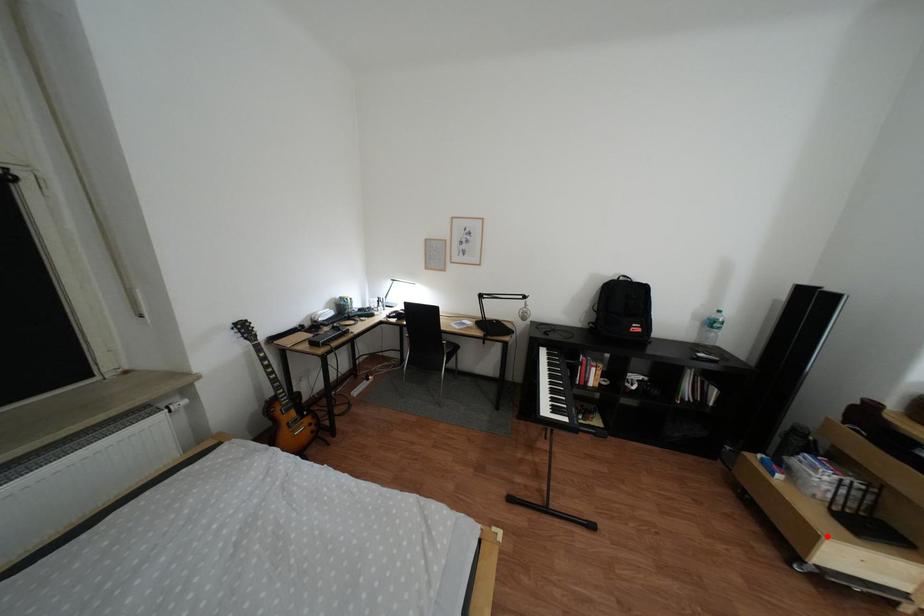
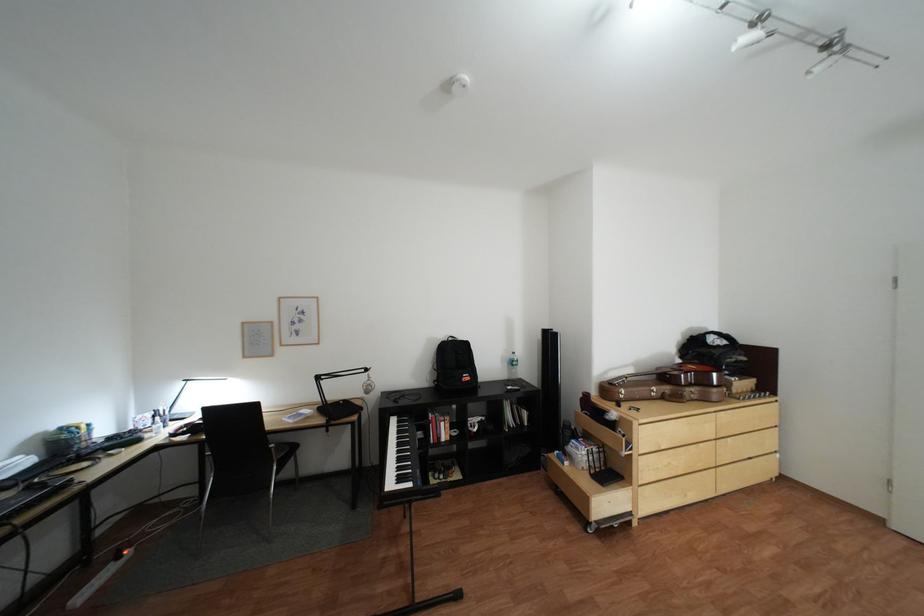
Question: I am providing you with two images of the same scene from different viewpoints. In image1, a red point is highlighted. Considering the same 3D point in image2, which of the following is correct?

Choices:
 (A) It is closer
 (B) It is farther

Answer: (B)